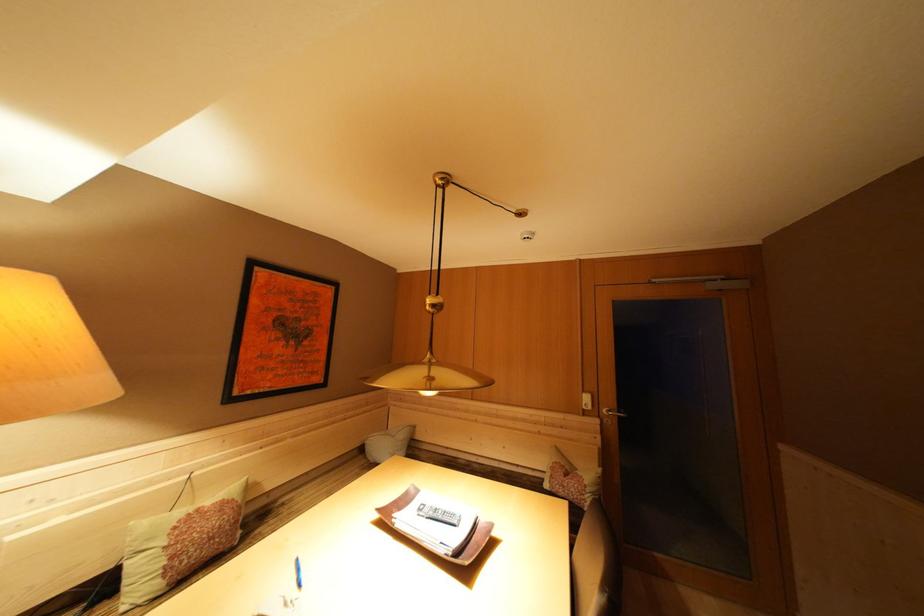
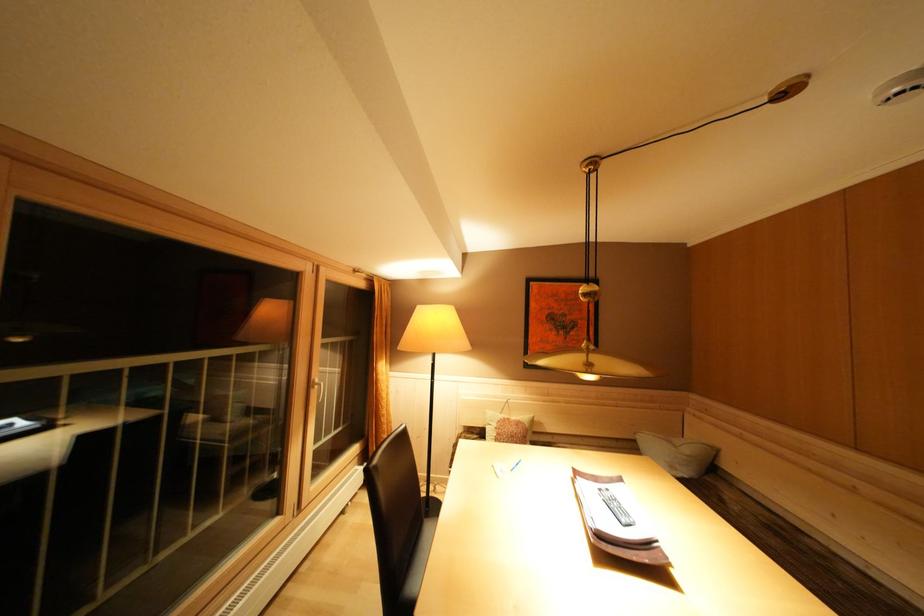
Find the pixel in the second image that matches pixel 204 515 in the first image.

(515, 424)